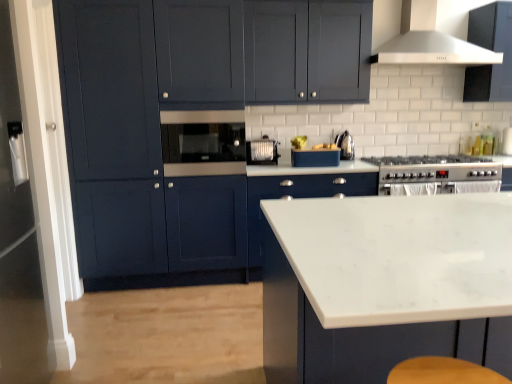
Question: Is white glossy cabinet at center, which is counted as the fourth cabinetry, starting from the front, inside silver metallic gas stove at center right?

Choices:
 (A) no
 (B) yes

Answer: (A)

Question: Is silver metallic gas stove at center right turned away from white glossy cabinet at center, which is counted as the fourth cabinetry, starting from the front?

Choices:
 (A) yes
 (B) no

Answer: (B)

Question: Is silver metallic gas stove at center right outside of white glossy cabinet at center, the first cabinetry from the back?

Choices:
 (A) no
 (B) yes

Answer: (B)

Question: Are silver metallic gas stove at center right and white glossy cabinet at center, the first cabinetry from the back, making contact?

Choices:
 (A) yes
 (B) no

Answer: (B)

Question: Can you confirm if silver metallic gas stove at center right is shorter than white glossy cabinet at center, the first cabinetry from the back?

Choices:
 (A) yes
 (B) no

Answer: (A)

Question: Is polished stainless steel kettle at right taller or shorter than white marble countertop at center, marked as the 1th cabinetry in a front-to-back arrangement?

Choices:
 (A) tall
 (B) short

Answer: (B)

Question: From the image's perspective, is polished stainless steel kettle at right above or below white marble countertop at center, the 4th cabinetry from the back?

Choices:
 (A) above
 (B) below

Answer: (A)

Question: Does point (347, 157) appear closer or farther from the camera than point (397, 205)?

Choices:
 (A) closer
 (B) farther

Answer: (B)

Question: Is polished stainless steel kettle at right bigger or smaller than white marble countertop at center, the 4th cabinetry from the back?

Choices:
 (A) big
 (B) small

Answer: (B)

Question: Looking at their shapes, would you say silver metallic gas stove at center right is wider or thinner than white marble countertop at center, marked as the 1th cabinetry in a front-to-back arrangement?

Choices:
 (A) thin
 (B) wide

Answer: (A)

Question: Is silver metallic gas stove at center right in front of or behind white marble countertop at center, the 4th cabinetry from the back, in the image?

Choices:
 (A) front
 (B) behind

Answer: (B)

Question: From a real-world perspective, relative to white marble countertop at center, the 4th cabinetry from the back, is silver metallic gas stove at center right vertically above or below?

Choices:
 (A) above
 (B) below

Answer: (A)

Question: Is silver metallic gas stove at center right inside or outside of white marble countertop at center, marked as the 1th cabinetry in a front-to-back arrangement?

Choices:
 (A) outside
 (B) inside

Answer: (A)

Question: Is point (406, 49) positioned closer to the camera than point (266, 150)?

Choices:
 (A) closer
 (B) farther

Answer: (B)

Question: In terms of width, does white matte range hood at upper center look wider or thinner when compared to white plastic toaster at center, the 2th appliance positioned from the right?

Choices:
 (A) thin
 (B) wide

Answer: (B)